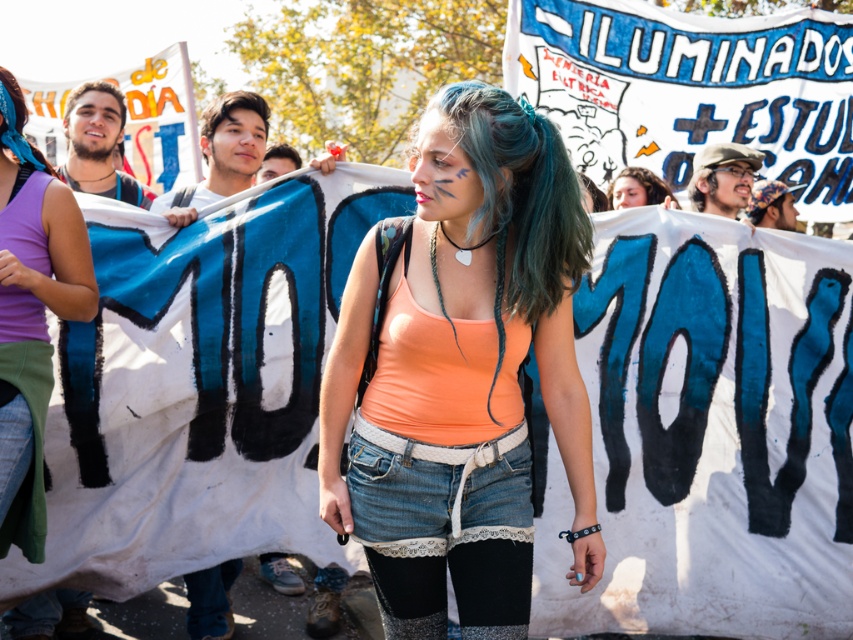
Based on the scene description, where is the matte purple tank top at left located in the image?

The matte purple tank top at left is located at point (32, 314) in the image.

You are a photographer trying to capture the protest scene. You notice the blue dyed hair at upper left and the blonde hair at center. Which hairstyle do you think will appear more prominent in your photo, and why?

The blue dyed hair at upper left will appear more prominent in the photo because it has a larger size compared to the blonde hair at center.